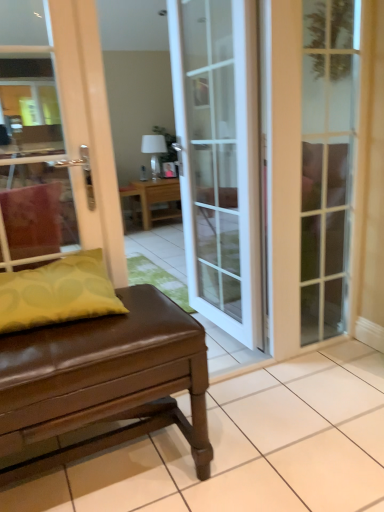
Question: Considering the relative positions of yellow fabric pillow at left and wooden table at center, positioned as the 1th table in top-to-bottom order, in the image provided, is yellow fabric pillow at left to the left of wooden table at center, positioned as the 1th table in top-to-bottom order, from the viewer's perspective?

Choices:
 (A) yes
 (B) no

Answer: (A)

Question: Considering the relative sizes of yellow fabric pillow at left and wooden table at center, the second table when ordered from front to back, in the image provided, is yellow fabric pillow at left shorter than wooden table at center, the second table when ordered from front to back,?

Choices:
 (A) yes
 (B) no

Answer: (A)

Question: Is yellow fabric pillow at left in contact with wooden table at center, the second table when ordered from front to back?

Choices:
 (A) no
 (B) yes

Answer: (A)

Question: Is yellow fabric pillow at left not near wooden table at center, positioned as the 1th table in top-to-bottom order?

Choices:
 (A) no
 (B) yes

Answer: (B)

Question: From a real-world perspective, is yellow fabric pillow at left over wooden table at center, the second table when ordered from front to back?

Choices:
 (A) yes
 (B) no

Answer: (A)

Question: Does yellow fabric pillow at left appear on the right side of wooden table at center, which is the second table from bottom to top?

Choices:
 (A) yes
 (B) no

Answer: (B)

Question: Is white glass door at center, marked as the first door in a left-to-right arrangement, located outside clear glass door at right, the first door positioned from the right?

Choices:
 (A) yes
 (B) no

Answer: (A)

Question: Is white glass door at center, the second door in the right-to-left sequence, at the right side of clear glass door at right, arranged as the second door when viewed from the left?

Choices:
 (A) no
 (B) yes

Answer: (A)

Question: Considering the relative sizes of white glass door at center, the second door in the right-to-left sequence, and clear glass door at right, the first door positioned from the right, in the image provided, is white glass door at center, the second door in the right-to-left sequence, wider than clear glass door at right, the first door positioned from the right,?

Choices:
 (A) no
 (B) yes

Answer: (A)

Question: Is clear glass door at right, arranged as the second door when viewed from the left, inside white glass door at center, marked as the first door in a left-to-right arrangement?

Choices:
 (A) no
 (B) yes

Answer: (A)

Question: Is the position of white glass door at center, the second door in the right-to-left sequence, more distant than that of clear glass door at right, the first door positioned from the right?

Choices:
 (A) no
 (B) yes

Answer: (A)

Question: Considering the relative sizes of white glass door at center, marked as the first door in a left-to-right arrangement, and clear glass door at right, arranged as the second door when viewed from the left, in the image provided, is white glass door at center, marked as the first door in a left-to-right arrangement, taller than clear glass door at right, arranged as the second door when viewed from the left,?

Choices:
 (A) yes
 (B) no

Answer: (A)

Question: Considering the relative positions of wooden table at center, acting as the first table starting from the back, and yellow fabric pillow at left in the image provided, is wooden table at center, acting as the first table starting from the back, to the right of yellow fabric pillow at left from the viewer's perspective?

Choices:
 (A) yes
 (B) no

Answer: (A)